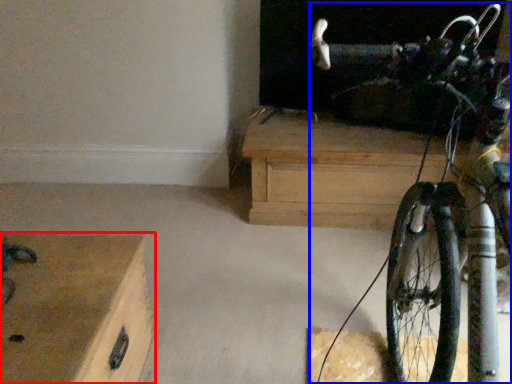
Question: Which object is further to the camera taking this photo, chest of drawers (highlighted by a red box) or bicycle (highlighted by a blue box)?

Choices:
 (A) chest of drawers
 (B) bicycle

Answer: (A)